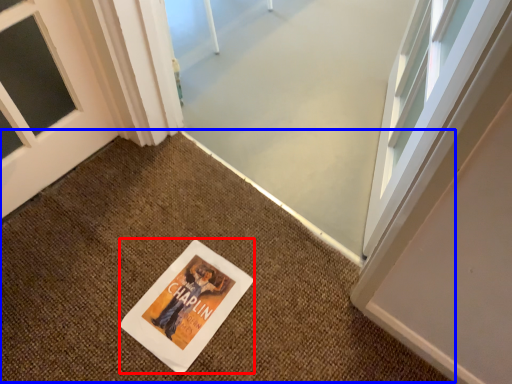
Question: Which object appears farthest to the camera in this image, flyer (highlighted by a red box) or doormat (highlighted by a blue box)?

Choices:
 (A) flyer
 (B) doormat

Answer: (A)